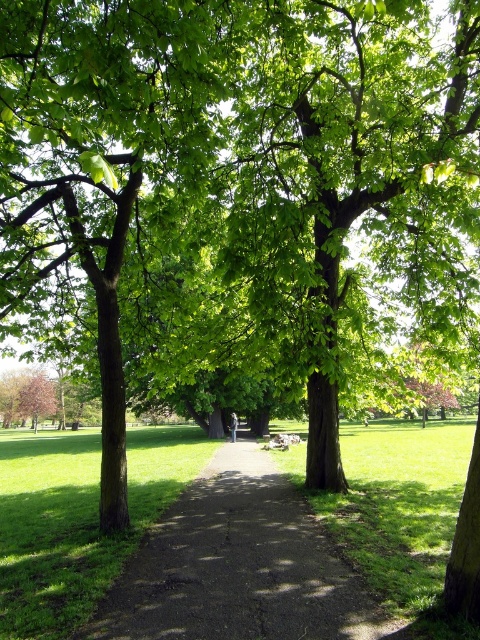
Looking at this image, between dirt path at center and green grass at center, which one appears on the left side from the viewer's perspective?

green grass at center

Does dirt path at center appear over green grass at center?

Indeed, dirt path at center is positioned over green grass at center.

Where is `dirt path at center`? dirt path at center is located at coordinates (239, 566).

Locate an element on the screen. dirt path at center is located at coordinates (239, 566).